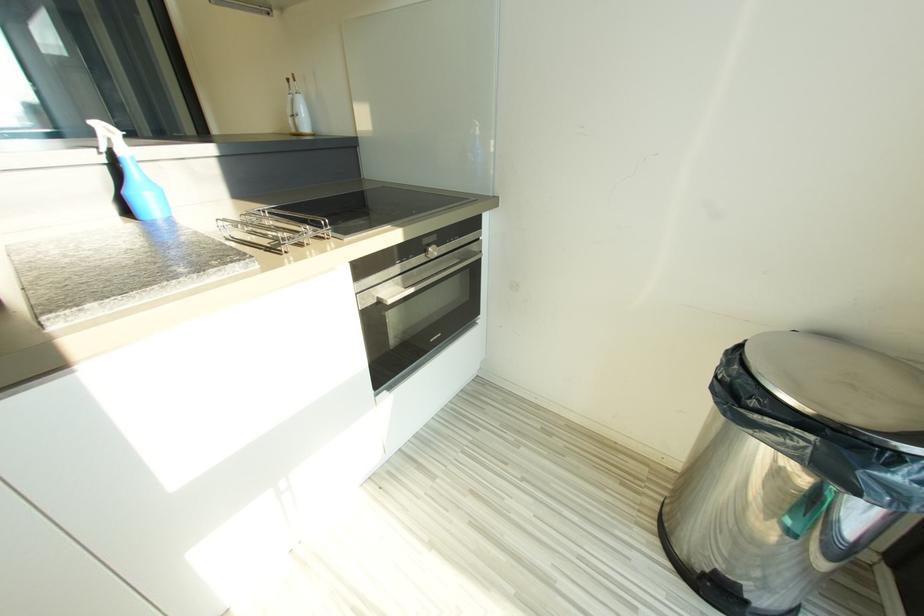
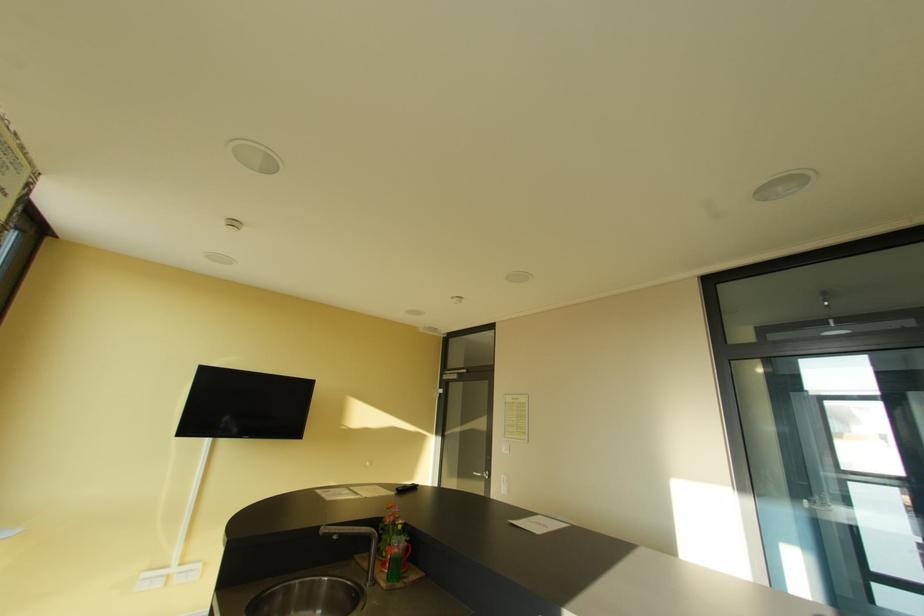
Question: The camera is either moving clockwise (left) or counter-clockwise (right) around the object. The first image is from the beginning of the video and the second image is from the end. Is the camera moving left or right when shooting the video?

Choices:
 (A) Left
 (B) Right

Answer: (B)